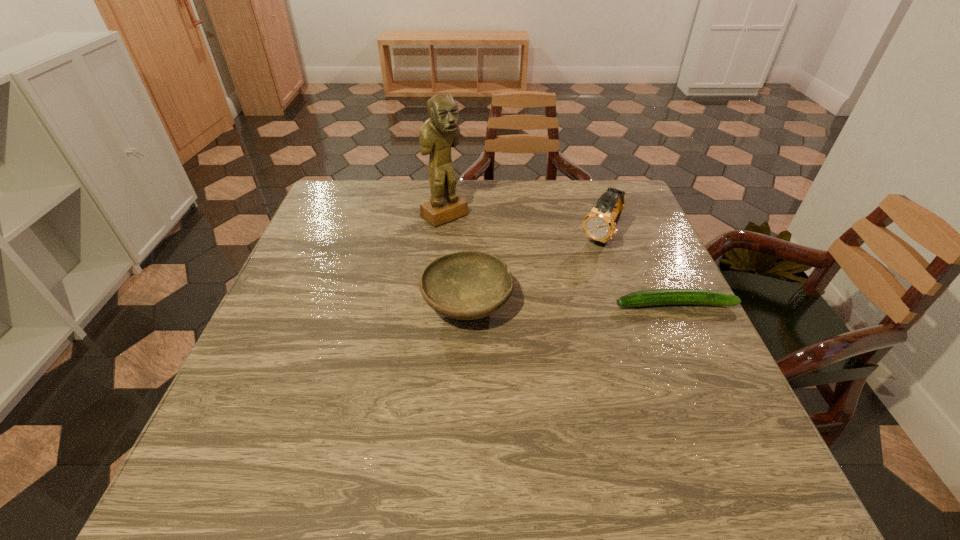
Identify which object is the third closest to the shortest object. Please provide its 2D coordinates. Your answer should be formatted as a tuple, i.e. [(x, y)], where the tuple contains the x and y coordinates of a point satisfying the conditions above.

[(441, 131)]

Where is `vacant area that satisfies the following two spatial constraints: 1. on the front side of the shortest object; 2. on the front-facing side of the figurine`? The width and height of the screenshot is (960, 540). vacant area that satisfies the following two spatial constraints: 1. on the front side of the shortest object; 2. on the front-facing side of the figurine is located at coordinates (435, 304).

Locate an element on the screen. The width and height of the screenshot is (960, 540). free point that satisfies the following two spatial constraints: 1. on the front side of the third tallest object; 2. on the front-facing side of the shortest object is located at coordinates point(467,304).

At what (x,y) coordinates should I click in order to perform the action: click on vacant point that satisfies the following two spatial constraints: 1. on the front side of the figurine; 2. on the left side of the watch. Please return your answer as a coordinate pair (x, y). The image size is (960, 540). Looking at the image, I should click on (442, 238).

Where is `vacant point that satisfies the following two spatial constraints: 1. on the front side of the tallest object; 2. on the left side of the second shortest object`? The height and width of the screenshot is (540, 960). vacant point that satisfies the following two spatial constraints: 1. on the front side of the tallest object; 2. on the left side of the second shortest object is located at coordinates (435, 303).